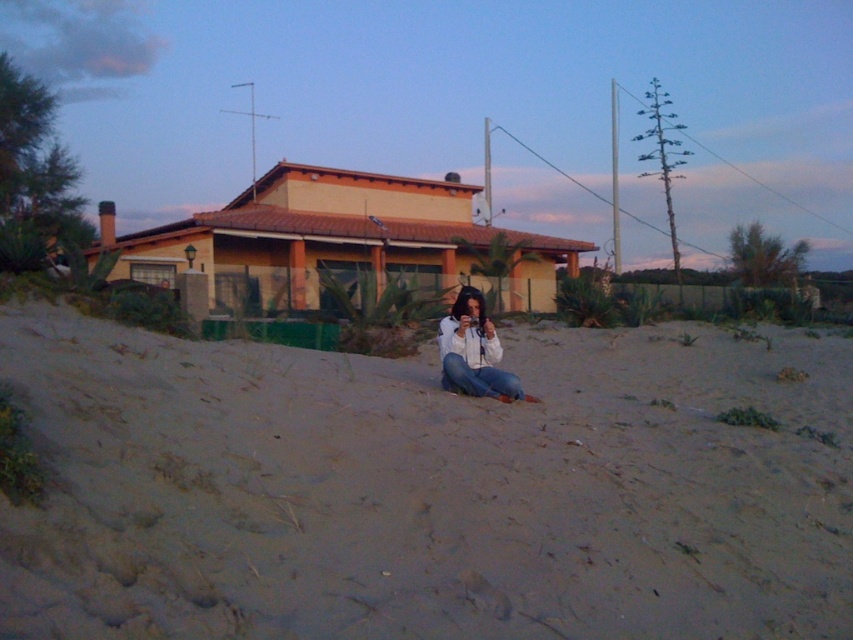
Question: Does smooth sand at center have a larger size compared to white matte shirt at center?

Choices:
 (A) no
 (B) yes

Answer: (B)

Question: Among these objects, which one is farthest from the camera?

Choices:
 (A) white matte shirt at center
 (B) smooth sand at center

Answer: (A)

Question: Can you confirm if smooth sand at center is wider than white matte shirt at center?

Choices:
 (A) no
 (B) yes

Answer: (B)

Question: Which object is closer to the camera taking this photo?

Choices:
 (A) white matte shirt at center
 (B) smooth sand at center

Answer: (B)

Question: Observing the image, what is the correct spatial positioning of smooth sand at center in reference to white matte shirt at center?

Choices:
 (A) below
 (B) above

Answer: (A)